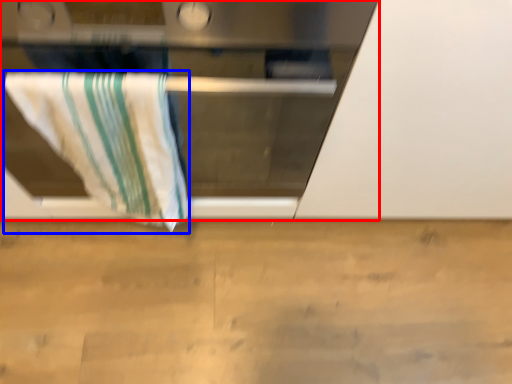
Question: Which point is closer to the camera, oven (highlighted by a red box) or towel (highlighted by a blue box)?

Choices:
 (A) oven
 (B) towel

Answer: (A)